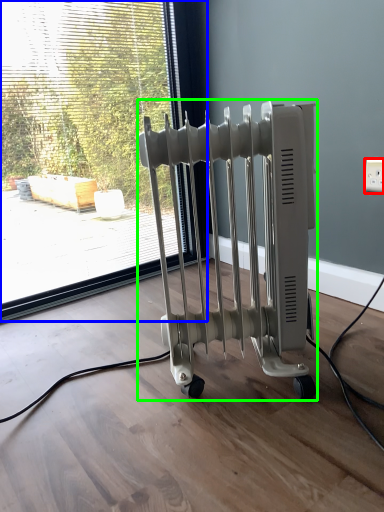
Question: Which object is positioned closest to electric outlet (highlighted by a red box)? Select from window (highlighted by a blue box) and bath heater (highlighted by a green box).

Choices:
 (A) window
 (B) bath heater

Answer: (B)